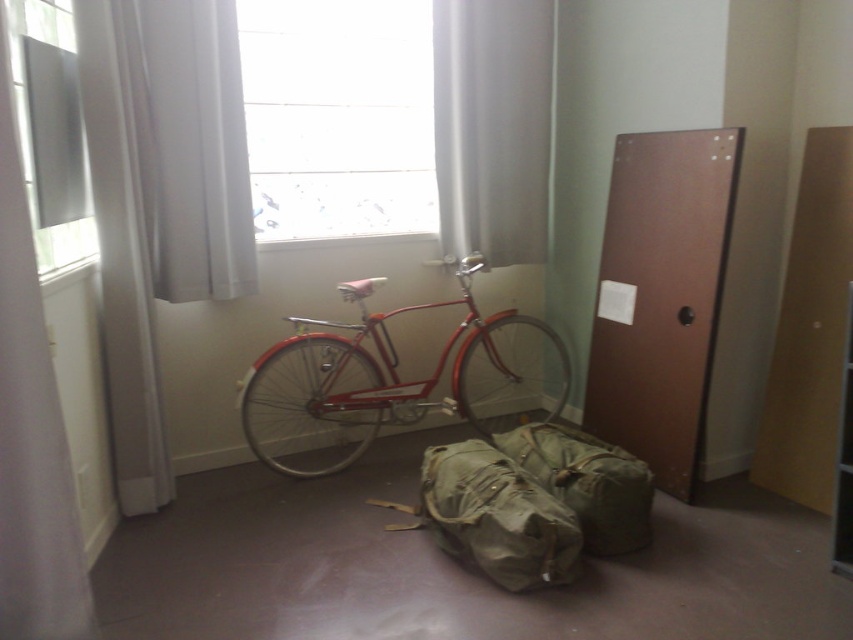
Is transparent glass window at upper center closer to the viewer compared to camouflage fabric duffel bag at center?

No, it is behind camouflage fabric duffel bag at center.

Which is below, transparent glass window at upper center or camouflage fabric duffel bag at center?

camouflage fabric duffel bag at center

The width and height of the screenshot is (853, 640). In order to click on transparent glass window at upper center in this screenshot , I will do `click(338, 116)`.

Which is more to the left, shiny red bicycle at center or white sheer curtain at left?

From the viewer's perspective, white sheer curtain at left appears more on the left side.

Who is more distant from viewer, (297, 472) or (9, 432)?

Point (297, 472)

This screenshot has height=640, width=853. What are the coordinates of `shiny red bicycle at center` in the screenshot? It's located at (393, 381).

In the scene shown: Which is above, transparent glass window at upper center or white sheer curtain at upper left?

transparent glass window at upper center is higher up.

Locate an element on the screen. transparent glass window at upper center is located at coordinates (338, 116).